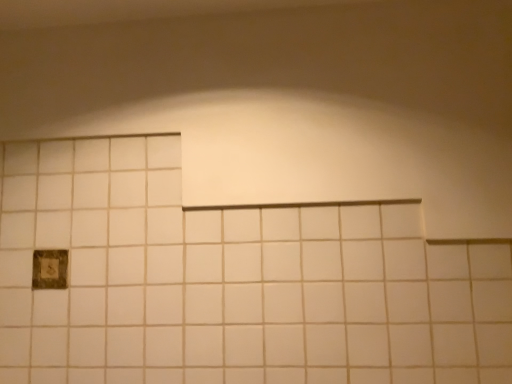
This screenshot has width=512, height=384. What do you see at coordinates (50, 269) in the screenshot?
I see `dark brown textured hole at lower left` at bounding box center [50, 269].

You are a GUI agent. You are given a task and a screenshot of the screen. Output one action in this format:
    pyautogui.click(x=<x>, y=<y>)
    Task: Click on the dark brown textured hole at lower left
    The height and width of the screenshot is (384, 512).
    Given the screenshot: What is the action you would take?
    pyautogui.click(x=50, y=269)

The width and height of the screenshot is (512, 384). I want to click on dark brown textured hole at lower left, so click(x=50, y=269).